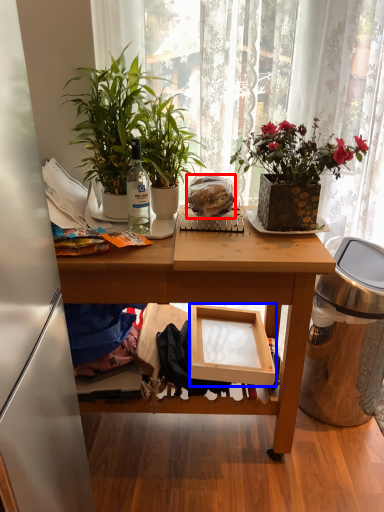
Question: Which point is closer to the camera, food (highlighted by a red box) or box (highlighted by a blue box)?

Choices:
 (A) food
 (B) box

Answer: (A)